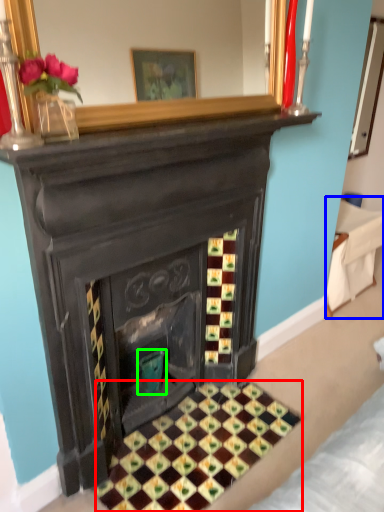
Question: Considering the real-world distances, which object is farthest from pattern (highlighted by a red box)? furniture (highlighted by a blue box) or teal (highlighted by a green box)?

Choices:
 (A) furniture
 (B) teal

Answer: (A)